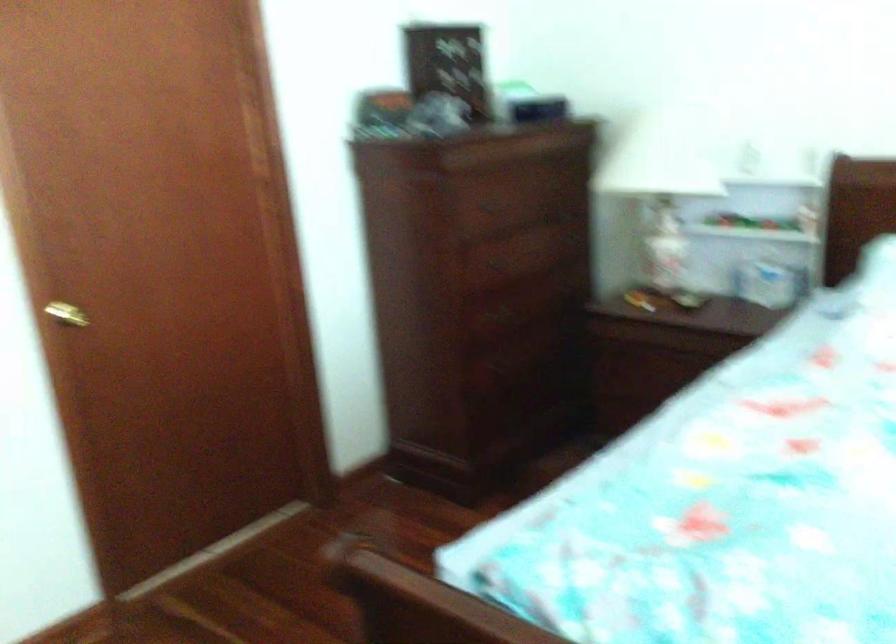
Image resolution: width=896 pixels, height=644 pixels. What do you see at coordinates (66, 314) in the screenshot? I see `the gold doorknob` at bounding box center [66, 314].